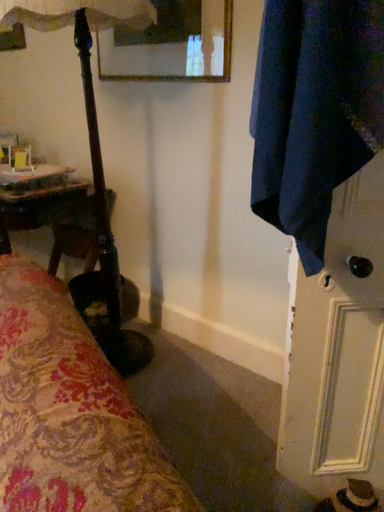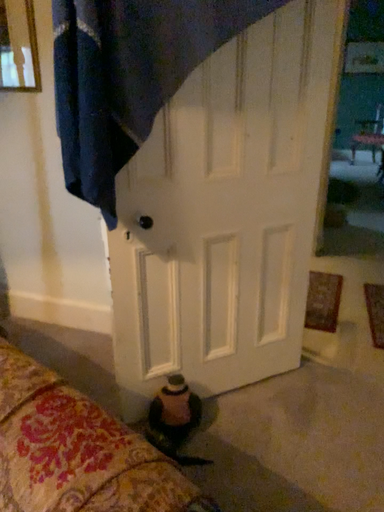
Question: Which way did the camera rotate in the video?

Choices:
 (A) rotated left
 (B) rotated right

Answer: (B)